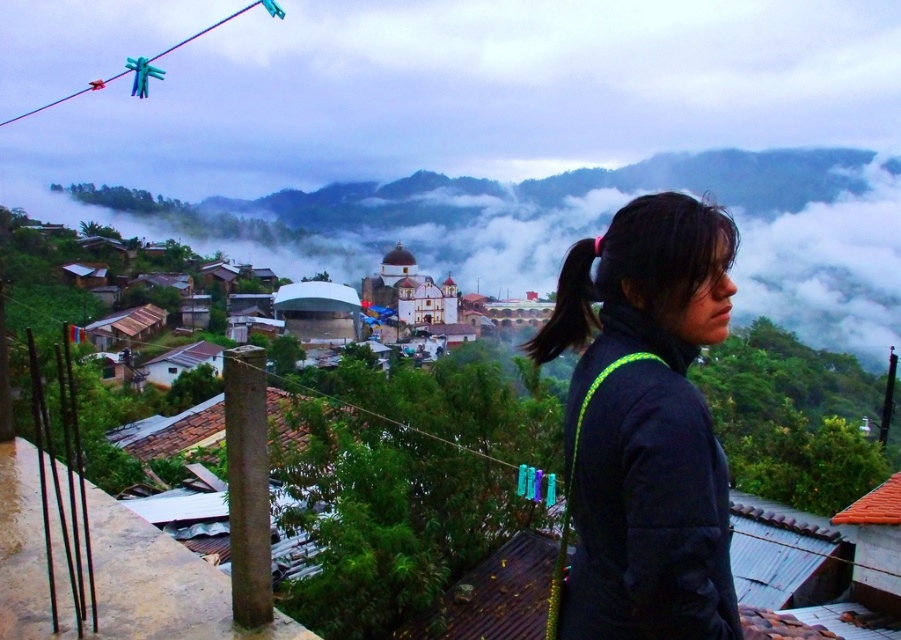
Can you confirm if black fleece jacket at right is wider than black hair at right?

In fact, black fleece jacket at right might be narrower than black hair at right.

Is black fleece jacket at right behind black hair at right?

No.

Does point (714, 220) come farther from viewer compared to point (556, 321)?

No, (714, 220) is in front of (556, 321).

Find the location of `black fleece jacket at right`. black fleece jacket at right is located at coordinates (645, 426).